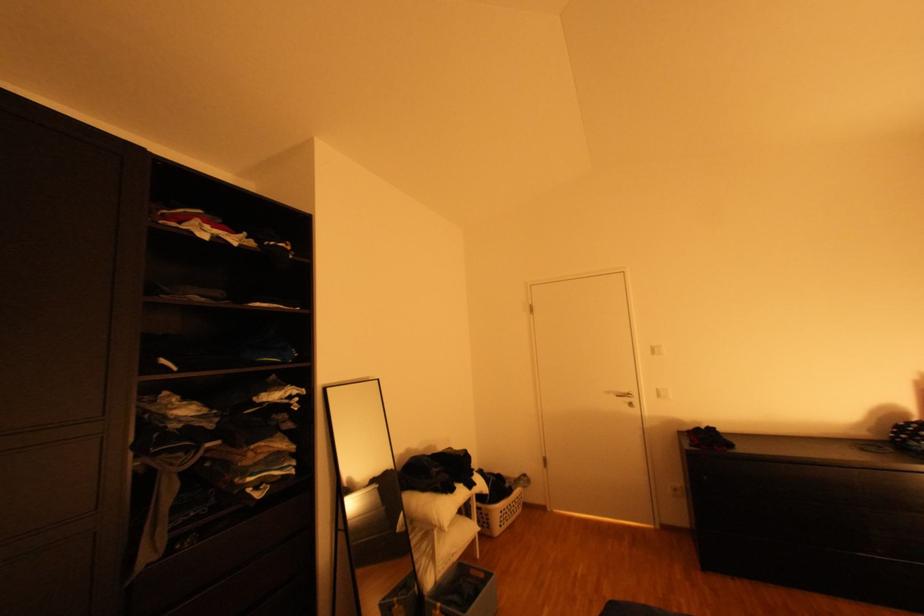
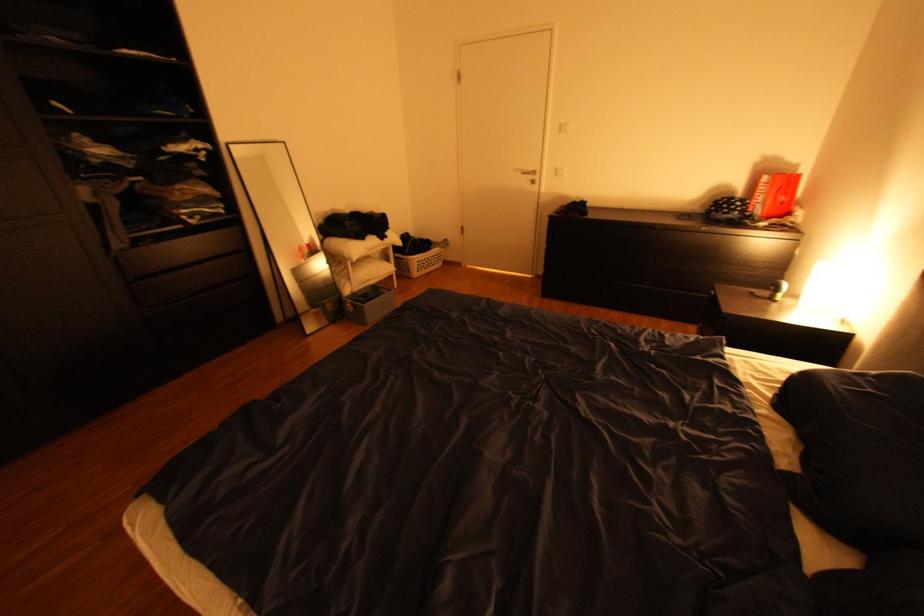
The point at (x=617, y=392) is marked in the first image. Where is the corresponding point in the second image?

(526, 171)